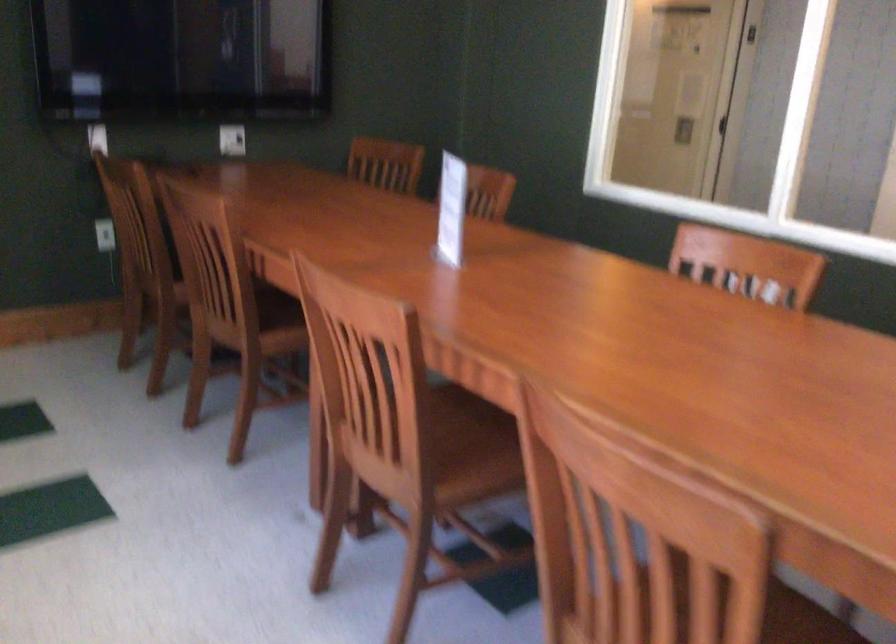
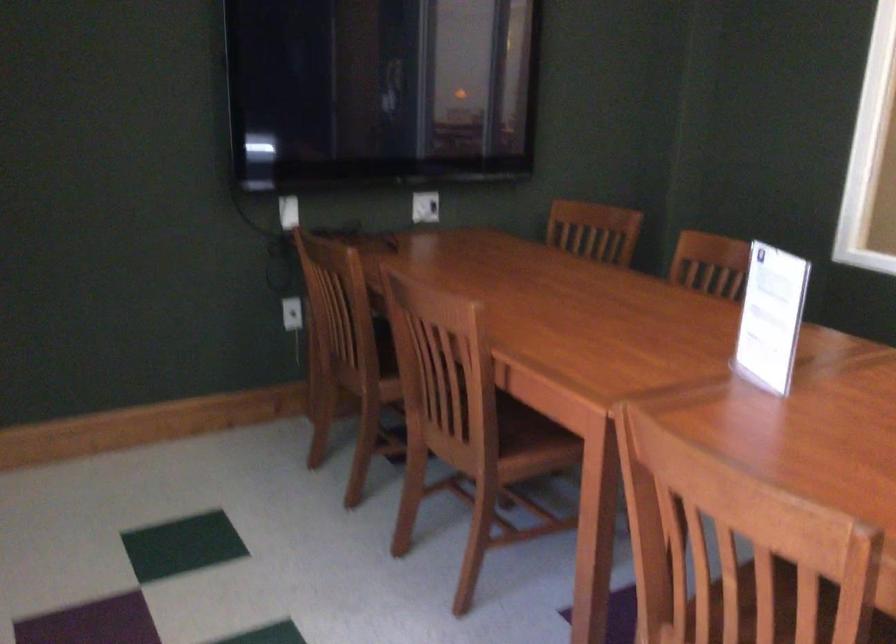
The images are taken continuously from a first-person perspective. In which direction are you moving?

The cameraman moved toward left, forward.